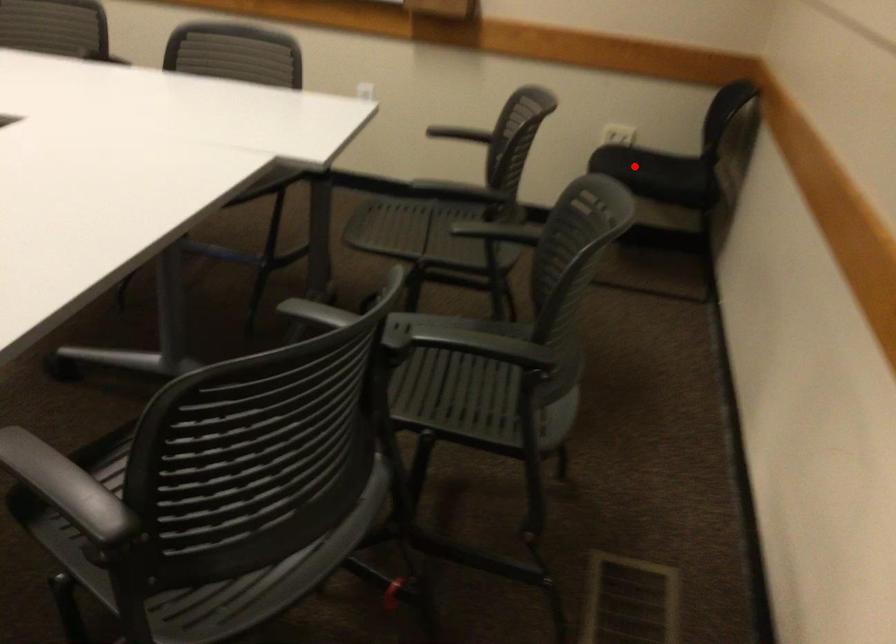
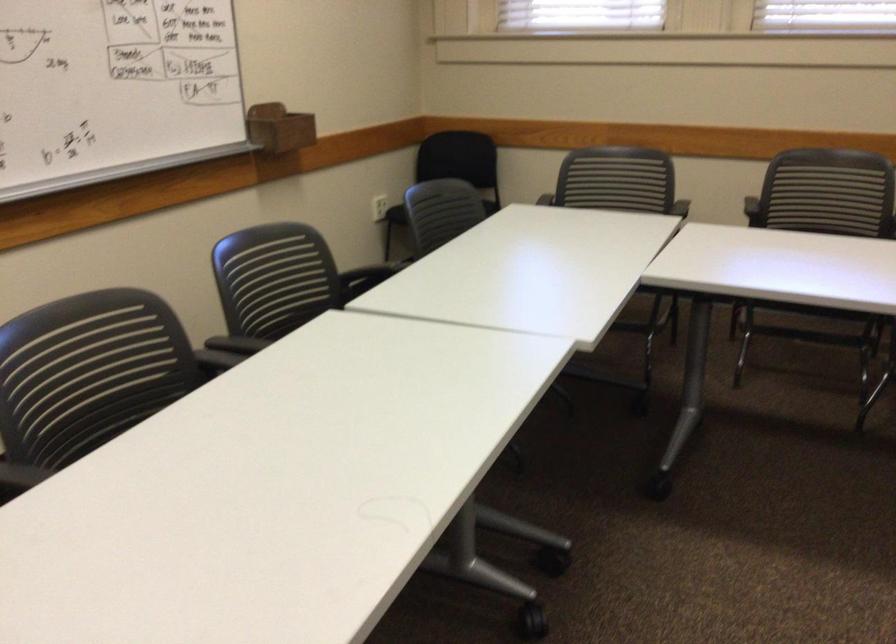
Question: I am providing you with two images of the same scene from different viewpoints. A red point is marked on the first image. Is the red point's position out of view in image 2?

Choices:
 (A) Yes
 (B) No

Answer: (A)